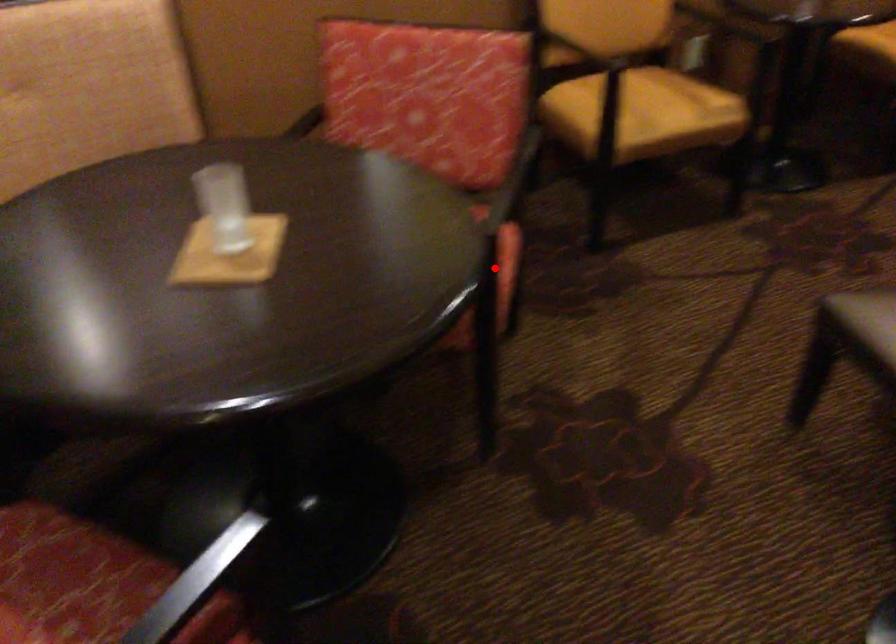
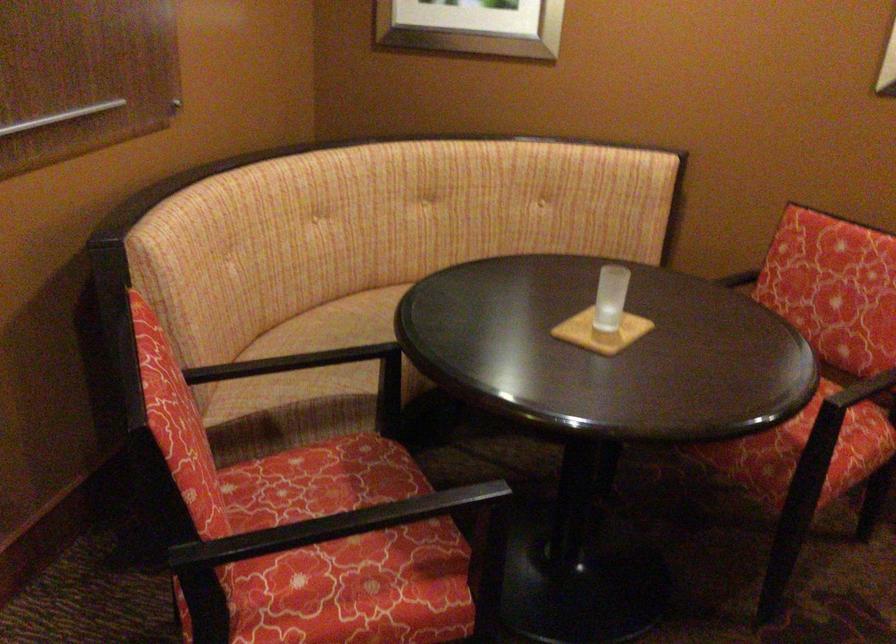
In the second image, find the point that corresponds to the highlighted location in the first image.

(826, 444)